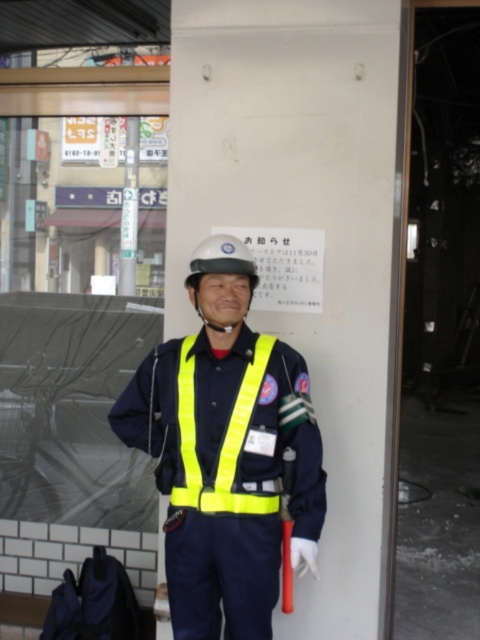
Question: Which of the following is the farthest from the observer?

Choices:
 (A) yellow reflective safety vest at center
 (B) yellow reflective vest at center

Answer: (A)

Question: Does yellow reflective vest at center lie behind yellow reflective safety vest at center?

Choices:
 (A) no
 (B) yes

Answer: (A)

Question: Which object is farther from the camera taking this photo?

Choices:
 (A) yellow reflective safety vest at center
 (B) yellow reflective vest at center

Answer: (A)

Question: Is yellow reflective vest at center above yellow reflective safety vest at center?

Choices:
 (A) yes
 (B) no

Answer: (B)

Question: Does yellow reflective vest at center appear over yellow reflective safety vest at center?

Choices:
 (A) no
 (B) yes

Answer: (A)

Question: Which object appears farthest from the camera in this image?

Choices:
 (A) yellow reflective vest at center
 (B) yellow reflective safety vest at center

Answer: (B)